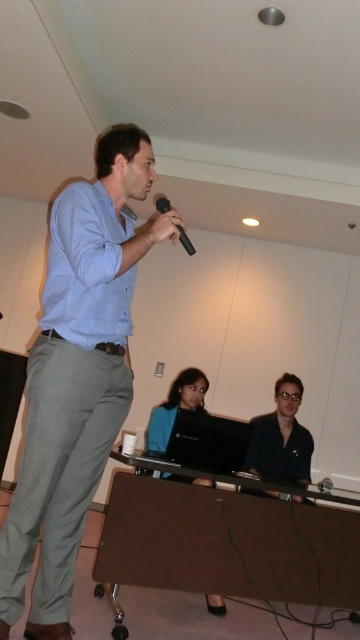
Which is above, matte blue shirt at center or black matte microphone at center?

black matte microphone at center is higher up.

Does matte blue shirt at center appear on the right side of black matte microphone at center?

No, matte blue shirt at center is not to the right of black matte microphone at center.

Image resolution: width=360 pixels, height=640 pixels. What are the coordinates of `matte blue shirt at center` in the screenshot? It's located at (77, 376).

Does black glossy shirt at center have a lesser height compared to black matte microphone at center?

In fact, black glossy shirt at center may be taller than black matte microphone at center.

Is point (286, 380) farther from camera compared to point (162, 196)?

That is True.

Who is more distant from viewer, (285, 406) or (185, 243)?

Point (285, 406)

Identify the location of black glossy shirt at center. (281, 436).

Is matte blue shirt at center further to camera compared to blue fabric shirt at center?

No, it is in front of blue fabric shirt at center.

Is point (72, 556) in front of point (159, 419)?

Yes, point (72, 556) is closer to viewer.

At what (x,y) coordinates should I click in order to perform the action: click on matte blue shirt at center. Please return your answer as a coordinate pair (x, y). The height and width of the screenshot is (640, 360). Looking at the image, I should click on (77, 376).